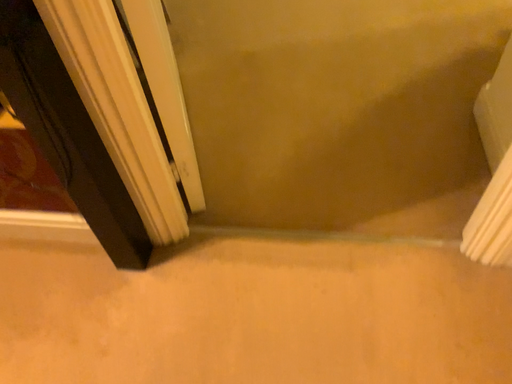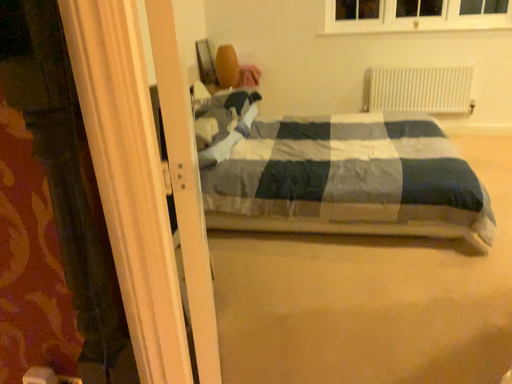
Question: How did the camera likely rotate when shooting the video?

Choices:
 (A) rotated downward
 (B) rotated upward

Answer: (B)